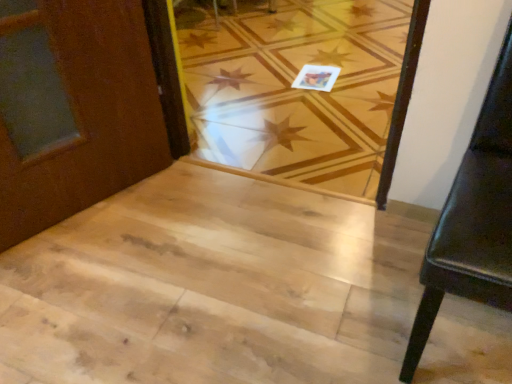
The height and width of the screenshot is (384, 512). Find the location of `vacant area situated below black leather chair at right (from a real-world perspective)`. vacant area situated below black leather chair at right (from a real-world perspective) is located at coordinates (456, 341).